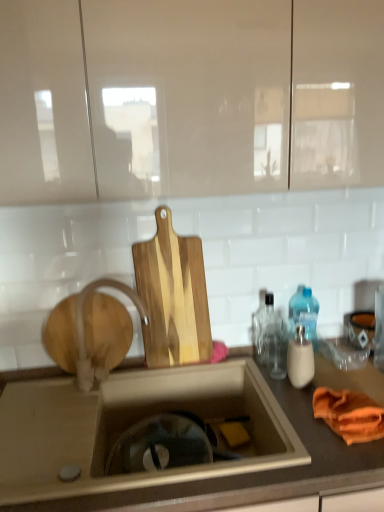
At what (x,y) coordinates should I click in order to perform the action: click on free point to the right of translucent glass bottle at right, positioned as the third bottle in back-to-front order. Please return your answer as a coordinate pair (x, y). The width and height of the screenshot is (384, 512). Looking at the image, I should click on click(343, 379).